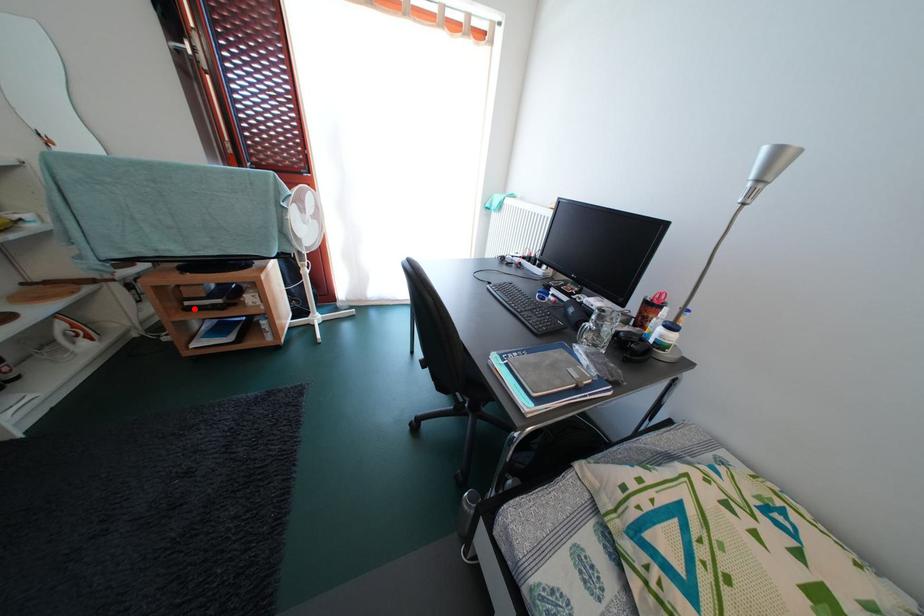
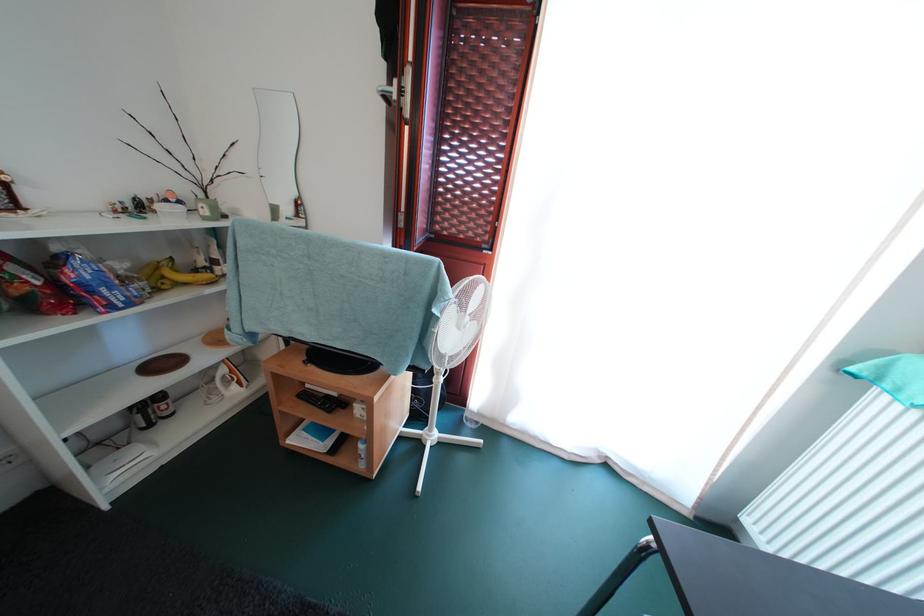
Question: I am providing you with two images of the same scene from different viewpoints. A red point is marked on the first image. Can you still see the location of the red point in image 2?

Choices:
 (A) Yes
 (B) No

Answer: (A)